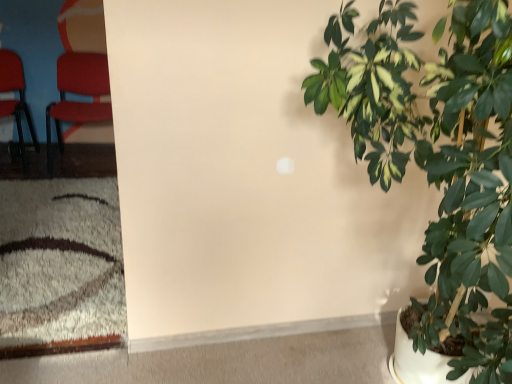
Question: Does white matte carpet at lower left turn towards matte red chair at left, marked as the 2th chair in a right-to-left arrangement?

Choices:
 (A) no
 (B) yes

Answer: (A)

Question: Considering the relative sizes of white matte carpet at lower left and matte red chair at left, marked as the 2th chair in a right-to-left arrangement, in the image provided, is white matte carpet at lower left wider than matte red chair at left, marked as the 2th chair in a right-to-left arrangement,?

Choices:
 (A) no
 (B) yes

Answer: (B)

Question: From the image's perspective, would you say white matte carpet at lower left is positioned over matte red chair at left, marked as the 2th chair in a right-to-left arrangement?

Choices:
 (A) yes
 (B) no

Answer: (B)

Question: Does white matte carpet at lower left lie behind matte red chair at left, which ranks as the first chair in left-to-right order?

Choices:
 (A) yes
 (B) no

Answer: (B)

Question: From a real-world perspective, is white matte carpet at lower left beneath matte red chair at left, marked as the 2th chair in a right-to-left arrangement?

Choices:
 (A) no
 (B) yes

Answer: (B)

Question: Is matte red chair at left, the first chair when ordered from right to left, taller or shorter than green glossy leafy plant at right?

Choices:
 (A) short
 (B) tall

Answer: (A)

Question: From the image's perspective, relative to green glossy leafy plant at right, is matte red chair at left, the first chair when ordered from right to left, above or below?

Choices:
 (A) above
 (B) below

Answer: (A)

Question: Considering their positions, is matte red chair at left, the first chair when ordered from right to left, located in front of or behind green glossy leafy plant at right?

Choices:
 (A) behind
 (B) front

Answer: (A)

Question: Is point (79, 112) positioned closer to the camera than point (484, 377)?

Choices:
 (A) farther
 (B) closer

Answer: (A)

Question: Relative to white matte carpet at lower left, is matte red chair at left, which ranks as the first chair in left-to-right order, in front or behind?

Choices:
 (A) behind
 (B) front

Answer: (A)

Question: In terms of height, does matte red chair at left, which ranks as the first chair in left-to-right order, look taller or shorter compared to white matte carpet at lower left?

Choices:
 (A) tall
 (B) short

Answer: (A)

Question: In terms of width, does matte red chair at left, marked as the 2th chair in a right-to-left arrangement, look wider or thinner when compared to white matte carpet at lower left?

Choices:
 (A) wide
 (B) thin

Answer: (B)

Question: Which is correct: matte red chair at left, which ranks as the first chair in left-to-right order, is inside white matte carpet at lower left, or outside of it?

Choices:
 (A) inside
 (B) outside

Answer: (B)

Question: Visually, is green glossy leafy plant at right positioned to the left or to the right of matte red chair at left, the first chair when ordered from right to left?

Choices:
 (A) right
 (B) left

Answer: (A)

Question: Is green glossy leafy plant at right wider or thinner than matte red chair at left, the 2th chair from the left?

Choices:
 (A) wide
 (B) thin

Answer: (A)